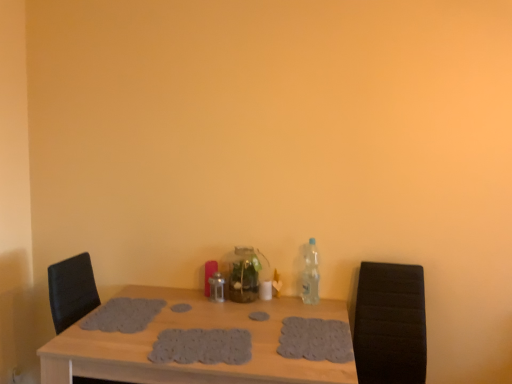
Measure the distance between point (170, 359) and camera.

Point (170, 359) and camera are 5.19 feet apart from each other.

The height and width of the screenshot is (384, 512). In order to click on wooden table at center in this screenshot , I will do `click(190, 328)`.

This screenshot has height=384, width=512. What do you see at coordinates (243, 273) in the screenshot?
I see `clear glass vase at center, the 1th bottle when ordered from left to right` at bounding box center [243, 273].

The height and width of the screenshot is (384, 512). Describe the element at coordinates (315, 340) in the screenshot. I see `gray textured placemat at center, which is the first footprint from right to left` at that location.

This screenshot has width=512, height=384. What do you see at coordinates (310, 274) in the screenshot?
I see `clear plastic bottle at right, positioned as the second bottle in left-to-right order` at bounding box center [310, 274].

Identify the location of gray knitted placemat at center, the third footprint viewed from the right. This screenshot has height=384, width=512. (202, 346).

Is point (230, 268) farther from camera compared to point (91, 315)?

Yes, it is behind point (91, 315).

Based on the photo, from the image's perspective, between clear glass vase at center, the 1th bottle when ordered from left to right, and gray crocheted placemat at center, the fourth footprint viewed from the right, which one is located above?

clear glass vase at center, the 1th bottle when ordered from left to right, is shown above in the image.

Does clear glass vase at center, the 1th bottle when ordered from left to right, contain gray crocheted placemat at center, the first footprint in the left-to-right sequence?

No, clear glass vase at center, the 1th bottle when ordered from left to right, does not contain gray crocheted placemat at center, the first footprint in the left-to-right sequence.

Which of these two, clear glass vase at center, the 1th bottle when ordered from left to right, or gray crocheted placemat at center, the first footprint in the left-to-right sequence, is smaller?

gray crocheted placemat at center, the first footprint in the left-to-right sequence.

Which object is closer to the camera taking this photo, clear plastic bottle at right, the first bottle from the right, or gray knitted placemat at center, positioned as the 2th footprint in left-to-right order?

gray knitted placemat at center, positioned as the 2th footprint in left-to-right order, is closer to the camera.

From the image's perspective, is clear plastic bottle at right, positioned as the second bottle in left-to-right order, above or below gray knitted placemat at center, positioned as the 2th footprint in left-to-right order?

clear plastic bottle at right, positioned as the second bottle in left-to-right order, is above gray knitted placemat at center, positioned as the 2th footprint in left-to-right order.

Is clear plastic bottle at right, positioned as the second bottle in left-to-right order, to the right of gray knitted placemat at center, the third footprint viewed from the right, from the viewer's perspective?

Correct, you'll find clear plastic bottle at right, positioned as the second bottle in left-to-right order, to the right of gray knitted placemat at center, the third footprint viewed from the right.

Considering the relative sizes of clear plastic bottle at right, the first bottle from the right, and gray knitted placemat at center, the third footprint viewed from the right, in the image provided, is clear plastic bottle at right, the first bottle from the right, wider than gray knitted placemat at center, the third footprint viewed from the right,?

Incorrect, the width of clear plastic bottle at right, the first bottle from the right, does not surpass that of gray knitted placemat at center, the third footprint viewed from the right.

Is gray textured placemat at center, marked as the fourth footprint in a left-to-right arrangement, bigger than gray knitted placemat at center, the third footprint viewed from the right?

Yes.

In the image, is gray textured placemat at center, marked as the fourth footprint in a left-to-right arrangement, on the left side or the right side of gray knitted placemat at center, positioned as the 2th footprint in left-to-right order?

Clearly, gray textured placemat at center, marked as the fourth footprint in a left-to-right arrangement, is on the right of gray knitted placemat at center, positioned as the 2th footprint in left-to-right order, in the image.

Is gray textured placemat at center, which is the first footprint from right to left, shorter than gray knitted placemat at center, positioned as the 2th footprint in left-to-right order?

Incorrect, the height of gray textured placemat at center, which is the first footprint from right to left, does not fall short of that of gray knitted placemat at center, positioned as the 2th footprint in left-to-right order.

Between clear glass vase at center, which is the second bottle from right to left, and gray knitted placemat at center, positioned as the 2th footprint in left-to-right order, which one is positioned in front?

gray knitted placemat at center, positioned as the 2th footprint in left-to-right order, is closer to the camera.

From a real-world perspective, is clear glass vase at center, the 1th bottle when ordered from left to right, positioned above or below gray knitted placemat at center, the third footprint viewed from the right?

In terms of real-world spatial position, clear glass vase at center, the 1th bottle when ordered from left to right, is above gray knitted placemat at center, the third footprint viewed from the right.

Is there a large distance between clear glass vase at center, the 1th bottle when ordered from left to right, and gray knitted placemat at center, positioned as the 2th footprint in left-to-right order?

They are positioned close to each other.

In the scene shown: Is clear glass vase at center, the 1th bottle when ordered from left to right, wider or thinner than gray knitted placemat at center, the third footprint viewed from the right?

Clearly, clear glass vase at center, the 1th bottle when ordered from left to right, has less width compared to gray knitted placemat at center, the third footprint viewed from the right.

Considering the positions of objects gray fabric placemat at center, the 3th footprint in the left-to-right sequence, and gray crocheted placemat at center, the fourth footprint viewed from the right, in the image provided, who is behind, gray fabric placemat at center, the 3th footprint in the left-to-right sequence, or gray crocheted placemat at center, the fourth footprint viewed from the right,?

gray fabric placemat at center, the 3th footprint in the left-to-right sequence, is further away from the camera.

Looking at the image, does gray fabric placemat at center, the 3th footprint in the left-to-right sequence, seem bigger or smaller compared to gray crocheted placemat at center, the fourth footprint viewed from the right?

Considering their sizes, gray fabric placemat at center, the 3th footprint in the left-to-right sequence, takes up less space than gray crocheted placemat at center, the fourth footprint viewed from the right.

From a real-world perspective, is gray fabric placemat at center, the 3th footprint in the left-to-right sequence, physically below gray crocheted placemat at center, the first footprint in the left-to-right sequence?

Correct, in the physical world, gray fabric placemat at center, the 3th footprint in the left-to-right sequence, is lower than gray crocheted placemat at center, the first footprint in the left-to-right sequence.

Is gray fabric placemat at center, which is the 2th footprint in right-to-left order, placed right next to gray crocheted placemat at center, the first footprint in the left-to-right sequence?

No, gray fabric placemat at center, which is the 2th footprint in right-to-left order, is not beside gray crocheted placemat at center, the first footprint in the left-to-right sequence.

In the image, is gray fabric placemat at center, the 3th footprint in the left-to-right sequence, on the left side or the right side of clear glass vase at center, which is the second bottle from right to left?

gray fabric placemat at center, the 3th footprint in the left-to-right sequence, is to the right of clear glass vase at center, which is the second bottle from right to left.

Looking at this image, which of these two, gray fabric placemat at center, which is the 2th footprint in right-to-left order, or clear glass vase at center, which is the second bottle from right to left, stands shorter?

gray fabric placemat at center, which is the 2th footprint in right-to-left order.

Is point (266, 316) in front of point (226, 278)?

Yes.

Is clear glass vase at center, which is the second bottle from right to left, located within gray fabric placemat at center, which is the 2th footprint in right-to-left order?

Actually, clear glass vase at center, which is the second bottle from right to left, is outside gray fabric placemat at center, which is the 2th footprint in right-to-left order.

Find the location of a particular element. This screenshot has height=384, width=512. armchair located in front of the gray textured placemat at center, marked as the fourth footprint in a left-to-right arrangement is located at coordinates (389, 323).

From a real-world perspective, is black leather armchair at right positioned under gray textured placemat at center, marked as the fourth footprint in a left-to-right arrangement, based on gravity?

Yes, from a real-world perspective, black leather armchair at right is under gray textured placemat at center, marked as the fourth footprint in a left-to-right arrangement.

Can you tell me how much black leather armchair at right and gray textured placemat at center, marked as the fourth footprint in a left-to-right arrangement, differ in facing direction?

There is a 0.679-degree angle between the facing directions of black leather armchair at right and gray textured placemat at center, marked as the fourth footprint in a left-to-right arrangement.

Which of these two, black leather armchair at right or gray textured placemat at center, which is the first footprint from right to left, stands shorter?

With less height is gray textured placemat at center, which is the first footprint from right to left.

The image size is (512, 384). Find the location of `the 1st bottle directly above the gray crocheted placemat at center, the fourth footprint viewed from the right (from a real-world perspective)`. the 1st bottle directly above the gray crocheted placemat at center, the fourth footprint viewed from the right (from a real-world perspective) is located at coordinates 243,273.

Find the location of `the 4th footprint below the clear plastic bottle at right, the first bottle from the right (from the image's perspective)`. the 4th footprint below the clear plastic bottle at right, the first bottle from the right (from the image's perspective) is located at coordinates (202, 346).

From the image, which object appears to be nearer to gray knitted placemat at center, the third footprint viewed from the right, gray textured placemat at center, marked as the fourth footprint in a left-to-right arrangement, or clear plastic bottle at right, the first bottle from the right?

gray textured placemat at center, marked as the fourth footprint in a left-to-right arrangement, is closer to gray knitted placemat at center, the third footprint viewed from the right.

When comparing their distances from clear glass vase at center, the 1th bottle when ordered from left to right, does gray crocheted placemat at center, the fourth footprint viewed from the right, or gray knitted placemat at center, the third footprint viewed from the right, seem closer?

Among the two, gray crocheted placemat at center, the fourth footprint viewed from the right, is located nearer to clear glass vase at center, the 1th bottle when ordered from left to right.

Considering their positions, is gray fabric placemat at center, the 3th footprint in the left-to-right sequence, positioned closer to clear plastic bottle at right, the first bottle from the right, than gray textured placemat at center, which is the first footprint from right to left?

gray fabric placemat at center, the 3th footprint in the left-to-right sequence, is positioned closer to the anchor clear plastic bottle at right, the first bottle from the right.

Based on their spatial positions, is clear plastic bottle at right, the first bottle from the right, or wooden table at center further from gray crocheted placemat at center, the fourth footprint viewed from the right?

clear plastic bottle at right, the first bottle from the right, lies further to gray crocheted placemat at center, the fourth footprint viewed from the right, than the other object.

Looking at the image, which one is located closer to clear glass vase at center, which is the second bottle from right to left, gray textured placemat at center, marked as the fourth footprint in a left-to-right arrangement, or black leather armchair at right?

The object closer to clear glass vase at center, which is the second bottle from right to left, is gray textured placemat at center, marked as the fourth footprint in a left-to-right arrangement.

Based on their spatial positions, is gray knitted placemat at center, positioned as the 2th footprint in left-to-right order, or clear glass vase at center, which is the second bottle from right to left, further from gray crocheted placemat at center, the fourth footprint viewed from the right?

clear glass vase at center, which is the second bottle from right to left, is positioned further to the anchor gray crocheted placemat at center, the fourth footprint viewed from the right.

Considering their positions, is clear plastic bottle at right, positioned as the second bottle in left-to-right order, positioned further to gray textured placemat at center, marked as the fourth footprint in a left-to-right arrangement, than wooden table at center?

clear plastic bottle at right, positioned as the second bottle in left-to-right order, lies further to gray textured placemat at center, marked as the fourth footprint in a left-to-right arrangement, than the other object.

Considering their positions, is black leather armchair at right positioned further to gray crocheted placemat at center, the first footprint in the left-to-right sequence, than clear plastic bottle at right, the first bottle from the right?

black leather armchair at right.

Identify the location of table between gray crocheted placemat at center, the fourth footprint viewed from the right, and clear plastic bottle at right, positioned as the second bottle in left-to-right order, from left to right. (190, 328).

Find the location of a particular element. The height and width of the screenshot is (384, 512). footprint between gray fabric placemat at center, which is the 2th footprint in right-to-left order, and black leather armchair at right is located at coordinates 315,340.

Where is `bottle positioned between gray knitted placemat at center, positioned as the 2th footprint in left-to-right order, and clear glass vase at center, which is the second bottle from right to left, from near to far`? bottle positioned between gray knitted placemat at center, positioned as the 2th footprint in left-to-right order, and clear glass vase at center, which is the second bottle from right to left, from near to far is located at coordinates pos(310,274).

The width and height of the screenshot is (512, 384). What are the coordinates of `table between gray knitted placemat at center, positioned as the 2th footprint in left-to-right order, and gray textured placemat at center, which is the first footprint from right to left, in the horizontal direction` in the screenshot? It's located at 190,328.